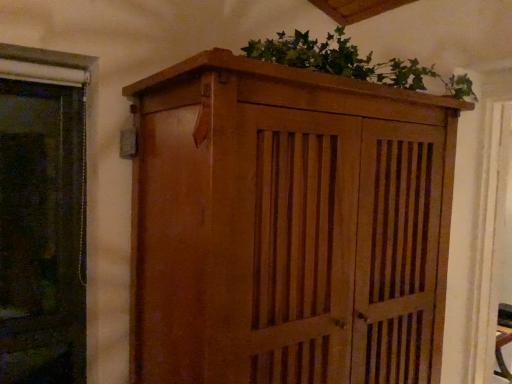
Question: Is wooden cabinet at center taller than green leafy plant at upper center?

Choices:
 (A) no
 (B) yes

Answer: (B)

Question: From a real-world perspective, is wooden cabinet at center on top of green leafy plant at upper center?

Choices:
 (A) no
 (B) yes

Answer: (A)

Question: Are wooden cabinet at center and green leafy plant at upper center far apart?

Choices:
 (A) no
 (B) yes

Answer: (A)

Question: Is green leafy plant at upper center inside wooden cabinet at center?

Choices:
 (A) yes
 (B) no

Answer: (B)

Question: Is wooden cabinet at center bigger than green leafy plant at upper center?

Choices:
 (A) no
 (B) yes

Answer: (B)

Question: Is wooden cabinet at center at the right side of green leafy plant at upper center?

Choices:
 (A) yes
 (B) no

Answer: (B)

Question: Is green leafy plant at upper center positioned before wooden cabinet at center?

Choices:
 (A) yes
 (B) no

Answer: (B)

Question: Is green leafy plant at upper center to the left of wooden cabinet at center from the viewer's perspective?

Choices:
 (A) no
 (B) yes

Answer: (A)

Question: From the image's perspective, is green leafy plant at upper center beneath wooden cabinet at center?

Choices:
 (A) yes
 (B) no

Answer: (B)

Question: Is there a large distance between green leafy plant at upper center and wooden cabinet at center?

Choices:
 (A) no
 (B) yes

Answer: (A)

Question: Does green leafy plant at upper center have a lesser width compared to wooden cabinet at center?

Choices:
 (A) yes
 (B) no

Answer: (A)

Question: Is green leafy plant at upper center taller than wooden cabinet at center?

Choices:
 (A) yes
 (B) no

Answer: (B)

Question: From a real-world perspective, is green leafy plant at upper center above or below wooden cabinet at center?

Choices:
 (A) below
 (B) above

Answer: (B)